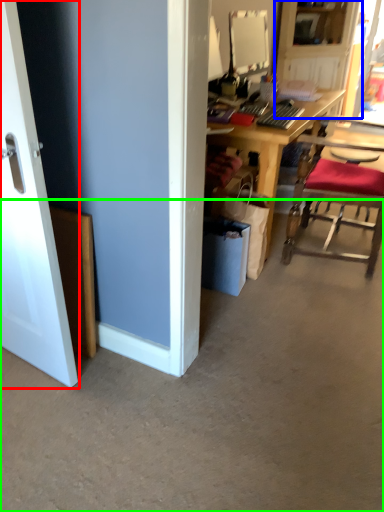
Question: Which object is positioned closest to door (highlighted by a red box)? Select from dresser (highlighted by a blue box) and concrete (highlighted by a green box).

Choices:
 (A) dresser
 (B) concrete

Answer: (B)